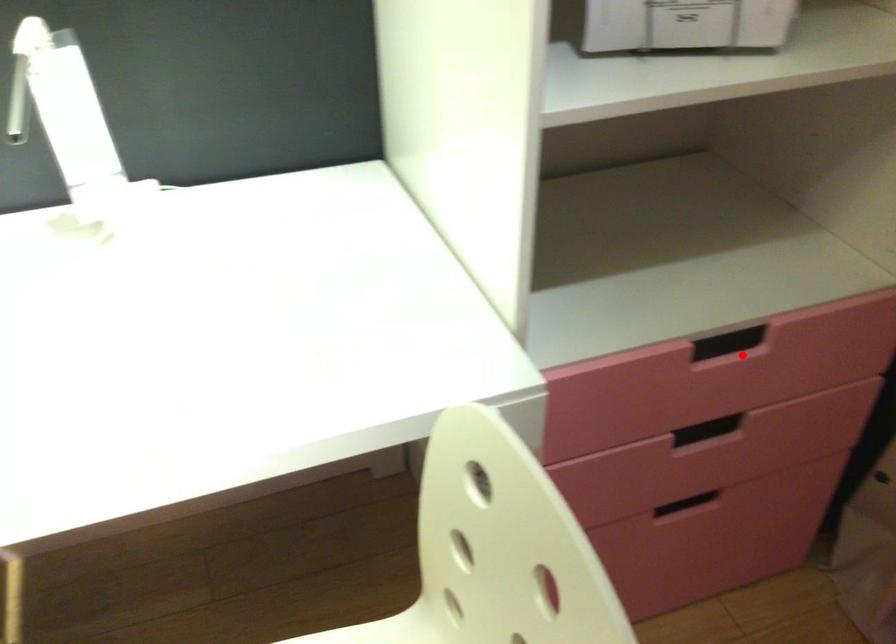
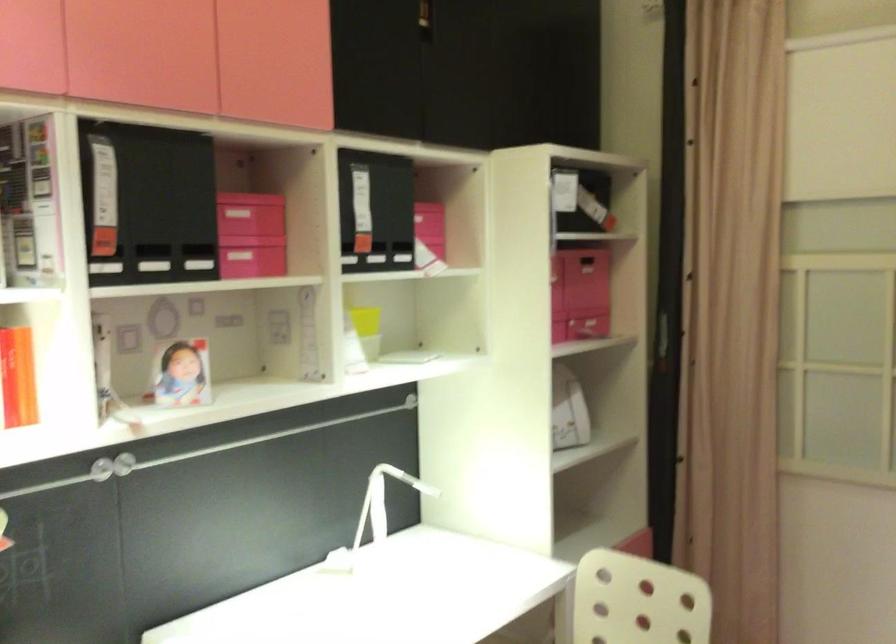
Question: I am providing you with two images of the same scene from different viewpoints. A red point is marked on the first image. Can you still see the location of the red point in image 2?

Choices:
 (A) Yes
 (B) No

Answer: (B)